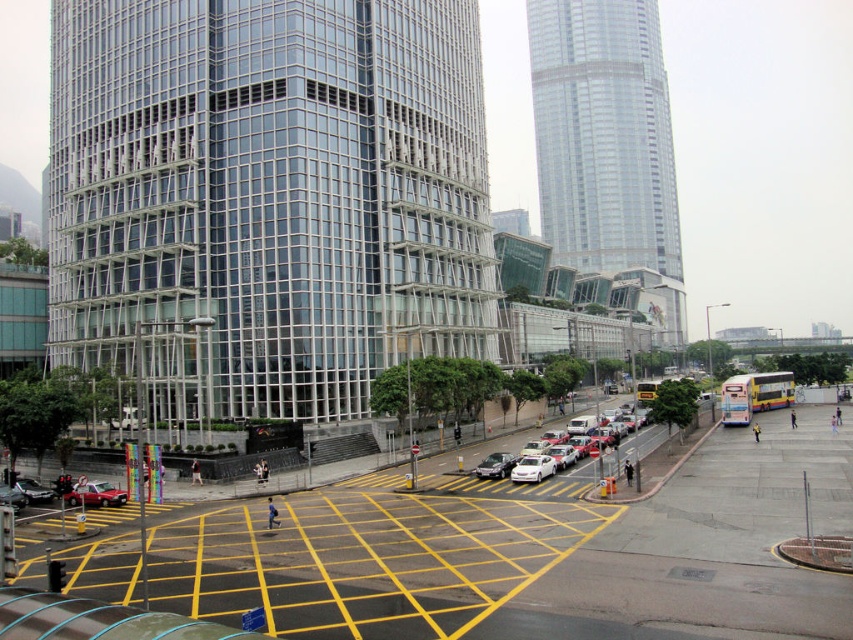
Who is higher up, metallic silver car at lower left or shiny silver sedan at center?

Positioned higher is shiny silver sedan at center.

Does point (91, 483) come in front of point (503, 454)?

Yes, point (91, 483) is closer to viewer.

At what (x,y) coordinates should I click in order to perform the action: click on metallic silver car at lower left. Please return your answer as a coordinate pair (x, y). Image resolution: width=853 pixels, height=640 pixels. Looking at the image, I should click on (96, 493).

Who is higher up, white glossy sedan at center or shiny silver sedan at center?

Positioned higher is white glossy sedan at center.

Which is behind, point (508, 476) or point (495, 472)?

Point (508, 476)

The height and width of the screenshot is (640, 853). I want to click on white glossy sedan at center, so click(x=566, y=444).

Which is more to the left, white glossy car at center or shiny silver sedan at center?

shiny silver sedan at center

Who is positioned more to the right, white glossy car at center or shiny silver sedan at center?

Positioned to the right is white glossy car at center.

Who is more distant from viewer, (x=537, y=456) or (x=509, y=452)?

Point (x=509, y=452)

In order to click on white glossy car at center in this screenshot , I will do `click(532, 468)`.